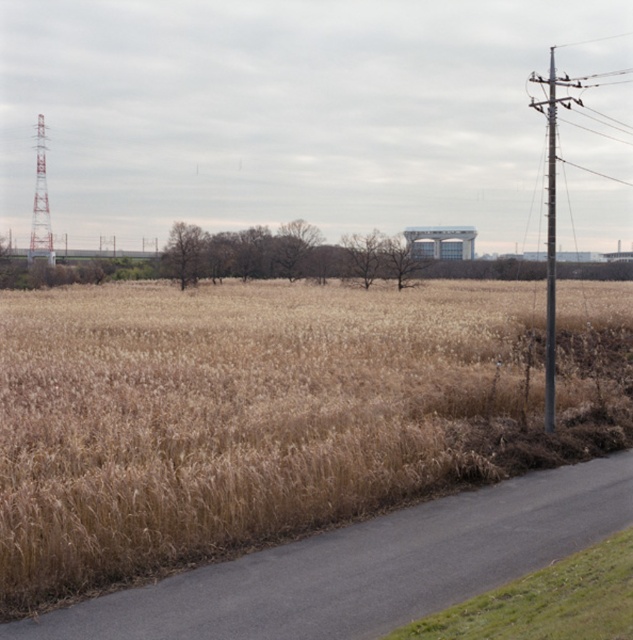
Question: Which object appears farthest from the camera in this image?

Choices:
 (A) metallic gray telegraph pole at right
 (B) white painted metal tower at left

Answer: (B)

Question: Considering the relative positions of brown grassy field at center and white painted metal tower at left in the image provided, where is brown grassy field at center located with respect to white painted metal tower at left?

Choices:
 (A) right
 (B) left

Answer: (A)

Question: Among these points, which one is nearest to the camera?

Choices:
 (A) (39, 164)
 (B) (553, 220)

Answer: (B)

Question: Can you confirm if metallic gray telegraph pole at right is wider than white painted metal tower at left?

Choices:
 (A) yes
 (B) no

Answer: (A)

Question: Is brown grassy field at center positioned before metallic gray telegraph pole at right?

Choices:
 (A) yes
 (B) no

Answer: (A)

Question: Among these points, which one is farthest from the camera?

Choices:
 (A) (546, 396)
 (B) (39, 170)

Answer: (B)